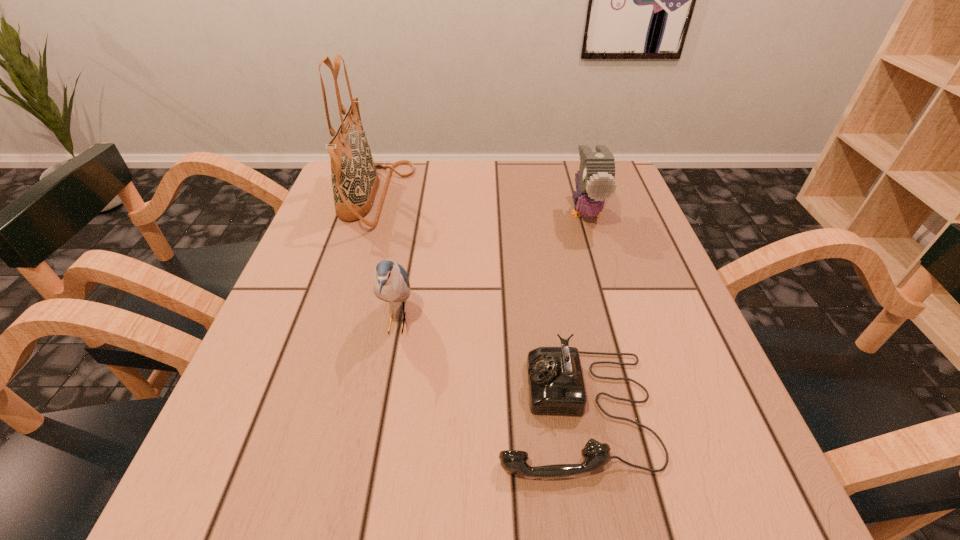
Where is `handbag`? This screenshot has height=540, width=960. handbag is located at coordinates (354, 177).

Where is `the right bird`? The height and width of the screenshot is (540, 960). the right bird is located at coordinates (595, 180).

The height and width of the screenshot is (540, 960). I want to click on the third farthest object, so click(x=390, y=280).

Locate an element on the screen. The width and height of the screenshot is (960, 540). the left bird is located at coordinates (390, 280).

You are a GUI agent. You are given a task and a screenshot of the screen. Output one action in this format:
    pyautogui.click(x=<x>, y=<y>)
    Task: Click on the shortest object
    
    Given the screenshot: What is the action you would take?
    pyautogui.click(x=556, y=386)

I want to click on telephone, so click(556, 386).

Find the location of `free space located on the front-facing side of the tallest object`. free space located on the front-facing side of the tallest object is located at coordinates (530, 197).

This screenshot has height=540, width=960. In order to click on vacant space located at the beak of the right bird in this screenshot , I will do `click(622, 333)`.

This screenshot has height=540, width=960. In order to click on blank space located 0.340m at the tip of the second nearest object's beak in this screenshot , I will do click(595, 322).

Where is `blank space located 0.360m on the dial of the telephone`? blank space located 0.360m on the dial of the telephone is located at coordinates (266, 410).